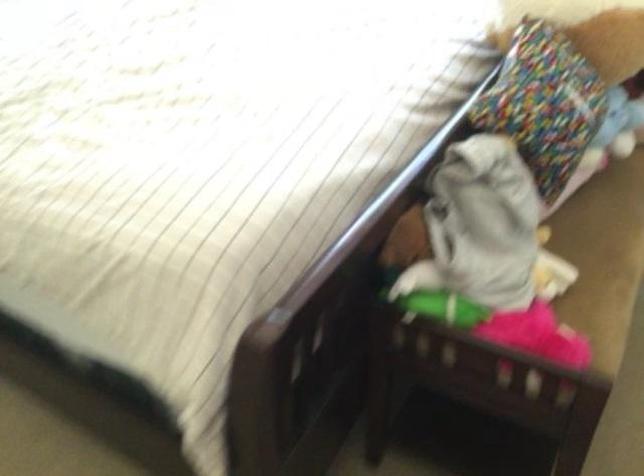
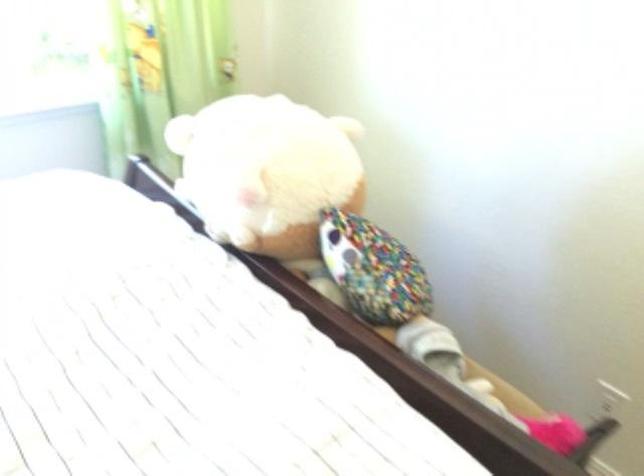
Question: The first image is from the beginning of the video and the second image is from the end. How did the camera likely rotate when shooting the video?

Choices:
 (A) Left
 (B) Right
 (C) Up
 (D) Down

Answer: (B)